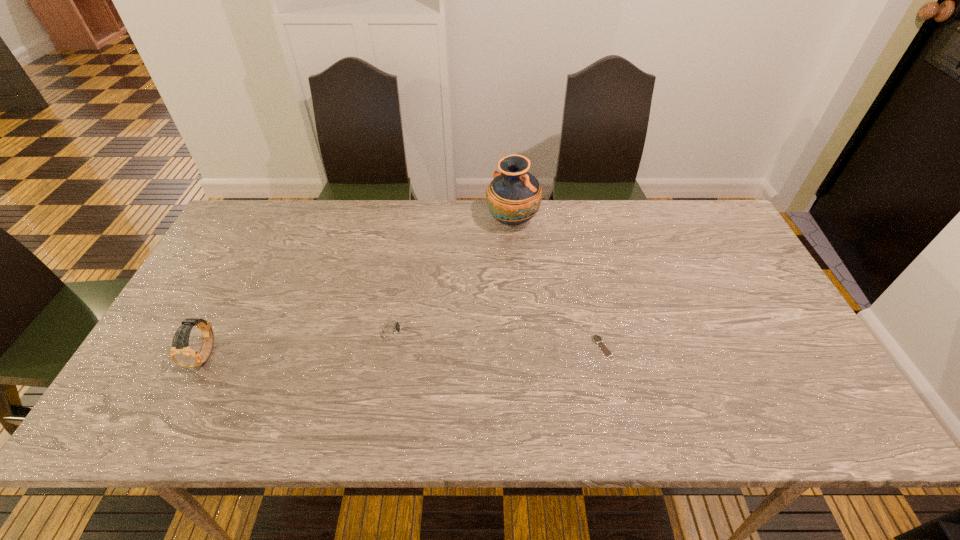
Where is `blank area located 0.260m on the face of the second object from left to right`? This screenshot has height=540, width=960. blank area located 0.260m on the face of the second object from left to right is located at coordinates (513, 330).

Find the location of a particular element. vacant region located 0.060m on the back of the shortest watch is located at coordinates (596, 316).

You are a GUI agent. You are given a task and a screenshot of the screen. Output one action in this format:
    pyautogui.click(x=<x>, y=<y>)
    Task: Click on the object that is positioned at the far edge
    The image size is (960, 540).
    Given the screenshot: What is the action you would take?
    pyautogui.click(x=514, y=196)

Find the location of a particular element. object located in the left edge section of the desktop is located at coordinates (181, 353).

Identify the location of free space at the far edge of the desktop. 562,210.

In the image, there is a desktop. In order to click on vacant space at the near edge in this screenshot , I will do `click(716, 410)`.

In the image, there is a desktop. Where is `vacant space at the left edge`? vacant space at the left edge is located at coordinates (198, 289).

In the image, there is a desktop. Where is `free space at the right edge`? This screenshot has height=540, width=960. free space at the right edge is located at coordinates (741, 338).

Where is `vacant area at the far left corner of the desktop`? vacant area at the far left corner of the desktop is located at coordinates (273, 211).

In the image, there is a desktop. At what (x,y) coordinates should I click in order to perform the action: click on vacant space at the far right corner. Please return your answer as a coordinate pair (x, y). Looking at the image, I should click on (728, 239).